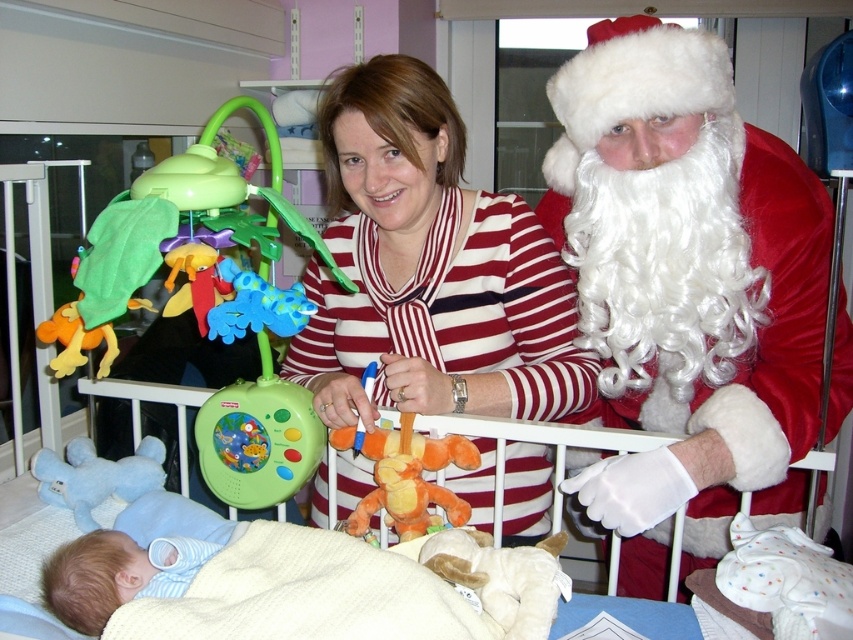
Question: Is white fluffy santa hat at upper right closer to camera compared to green plastic mobile at upper left?

Choices:
 (A) no
 (B) yes

Answer: (A)

Question: Does white fluffy santa hat at upper right come in front of striped fabric shirt at center?

Choices:
 (A) yes
 (B) no

Answer: (A)

Question: Which object is positioned farthest from the plush orange monkey at center?

Choices:
 (A) striped fabric shirt at center
 (B) light blue cotton swaddle at lower left
 (C) white fluffy santa hat at upper right

Answer: (C)

Question: Which point is farther to the camera?

Choices:
 (A) [x=157, y=582]
 (B) [x=422, y=452]

Answer: (B)

Question: Among these points, which one is farthest from the camera?

Choices:
 (A) (497, 620)
 (B) (85, 465)
 (C) (819, 307)
 (D) (82, 564)

Answer: (B)

Question: Can you confirm if green plastic mobile at upper left is wider than light blue cotton swaddle at lower left?

Choices:
 (A) no
 (B) yes

Answer: (B)